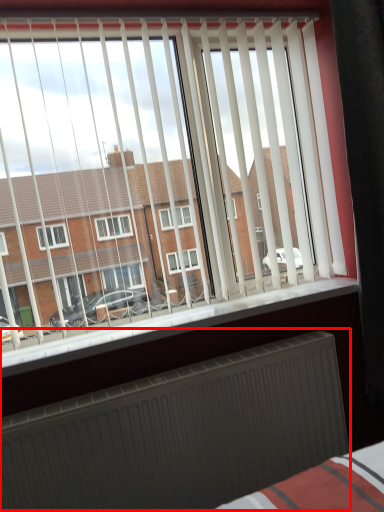
Question: In this image, where is radiator (annotated by the red box) located relative to window sill?

Choices:
 (A) right
 (B) left

Answer: (B)